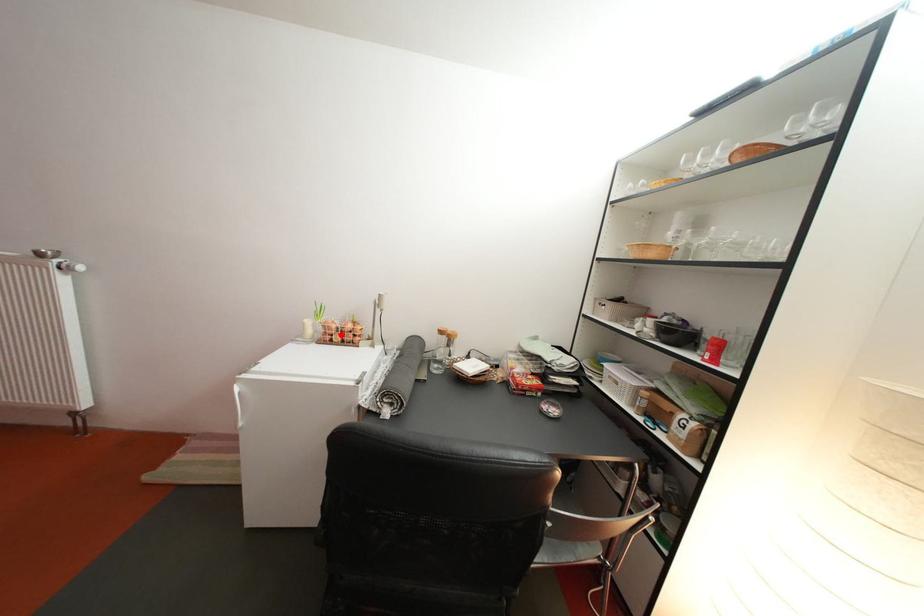
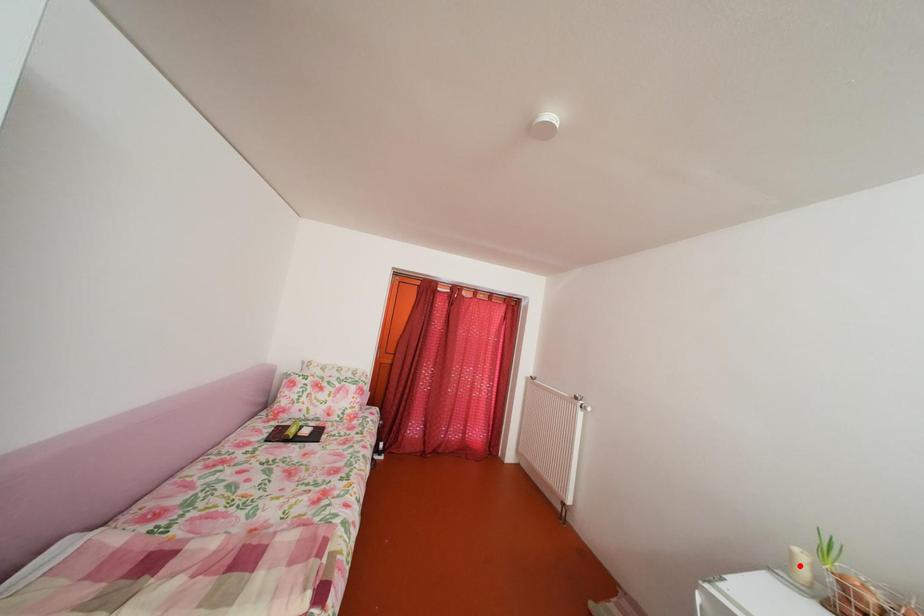
I am providing you with two images of the same scene from different viewpoints. A red point is marked on the first image and another point is marked on the second image. Is the marked point in image1 the same physical position as the marked point in image2?

No